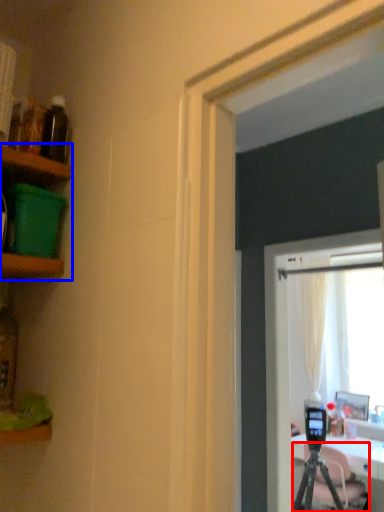
Question: Which point is closer to the camera, tripod (highlighted by a red box) or shelf (highlighted by a blue box)?

Choices:
 (A) tripod
 (B) shelf

Answer: (B)